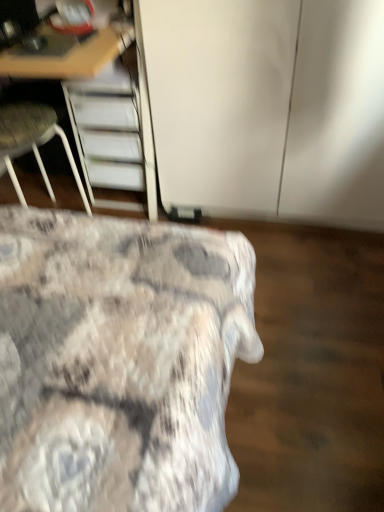
Where is `wooden desk at upper left`? wooden desk at upper left is located at coordinates (72, 57).

What do you see at coordinates (269, 106) in the screenshot?
I see `white glossy cabinet at upper center` at bounding box center [269, 106].

Locate an element on the screen. textured fabric bed at lower left is located at coordinates (119, 361).

Who is shorter, white fabric chair at left or textured fabric bed at lower left?

With less height is textured fabric bed at lower left.

Would you consider white fabric chair at left to be distant from textured fabric bed at lower left?

No.

From the picture: From the image's perspective, which one is positioned lower, white fabric chair at left or textured fabric bed at lower left?

textured fabric bed at lower left, from the image's perspective.

Is the position of white fabric chair at left less distant than that of white glossy cabinet at upper center?

No, it is not.

Between white fabric chair at left and white glossy cabinet at upper center, which one has smaller size?

Smaller between the two is white fabric chair at left.

How distant is white fabric chair at left from white glossy cabinet at upper center?

A distance of 27.78 inches exists between white fabric chair at left and white glossy cabinet at upper center.

I want to click on chair below the white glossy cabinet at upper center (from a real-world perspective), so click(32, 142).

Between white glossy cabinet at upper center and textured fabric bed at lower left, which one has less height?

Standing shorter between the two is textured fabric bed at lower left.

Could you tell me if white glossy cabinet at upper center is facing textured fabric bed at lower left?

Yes, white glossy cabinet at upper center is turned towards textured fabric bed at lower left.

Would you say textured fabric bed at lower left is part of white glossy cabinet at upper center's contents?

No, textured fabric bed at lower left is located outside of white glossy cabinet at upper center.

From a real-world perspective, is white glossy cabinet at upper center above or below textured fabric bed at lower left?

Clearly, from a real-world perspective, white glossy cabinet at upper center is above textured fabric bed at lower left.

Can you confirm if textured fabric bed at lower left is thinner than wooden desk at upper left?

No.

Between textured fabric bed at lower left and wooden desk at upper left, which one has more height?

wooden desk at upper left is taller.

Is textured fabric bed at lower left further to camera compared to wooden desk at upper left?

No, textured fabric bed at lower left is in front of wooden desk at upper left.

From the picture: Visually, is white fabric chair at left positioned to the left or to the right of wooden desk at upper left?

From the image, it's evident that white fabric chair at left is to the left of wooden desk at upper left.

From the image's perspective, is white fabric chair at left positioned above or below wooden desk at upper left?

white fabric chair at left is below wooden desk at upper left.

Can wooden desk at upper left be found inside white fabric chair at left?

No, wooden desk at upper left is not surrounded by white fabric chair at left.

From a real-world perspective, is white fabric chair at left physically located above or below wooden desk at upper left?

white fabric chair at left is situated lower than wooden desk at upper left in the real world.

From a real-world perspective, relative to white fabric chair at left, is white glossy cabinet at upper center vertically above or below?

white glossy cabinet at upper center is above white fabric chair at left.

Is there a large distance between white glossy cabinet at upper center and white fabric chair at left?

white glossy cabinet at upper center is actually quite close to white fabric chair at left.

Can you confirm if white glossy cabinet at upper center is smaller than white fabric chair at left?

No, white glossy cabinet at upper center is not smaller than white fabric chair at left.

The width and height of the screenshot is (384, 512). Find the location of `cabinetry to the right of white fabric chair at left`. cabinetry to the right of white fabric chair at left is located at coordinates [x=269, y=106].

Which point is more distant from viewer, (91, 45) or (128, 492)?

The point (91, 45) is farther.

From a real-world perspective, which object stands above the other?

wooden desk at upper left, from a real-world perspective.

Can textured fabric bed at lower left be found inside wooden desk at upper left?

Definitely not — textured fabric bed at lower left is not inside wooden desk at upper left.

Find the location of `bed that appears in front of the wooden desk at upper left`. bed that appears in front of the wooden desk at upper left is located at coordinates (119, 361).

Find the location of a particular element. chair behind the textured fabric bed at lower left is located at coordinates (32, 142).

Locate an element on the screen. chair below the white glossy cabinet at upper center (from the image's perspective) is located at coordinates click(x=32, y=142).

Which object lies nearer to the anchor point white fabric chair at left, textured fabric bed at lower left or white glossy cabinet at upper center?

white glossy cabinet at upper center is positioned closer to the anchor white fabric chair at left.

Which object lies nearer to the anchor point wooden desk at upper left, textured fabric bed at lower left or white fabric chair at left?

white fabric chair at left lies closer to wooden desk at upper left than the other object.

Which object lies further to the anchor point white glossy cabinet at upper center, wooden desk at upper left or textured fabric bed at lower left?

textured fabric bed at lower left lies further to white glossy cabinet at upper center than the other object.

From the picture: Based on their spatial positions, is wooden desk at upper left or white glossy cabinet at upper center closer to textured fabric bed at lower left?

wooden desk at upper left lies closer to textured fabric bed at lower left than the other object.

Which object lies nearer to the anchor point white fabric chair at left, textured fabric bed at lower left or wooden desk at upper left?

Answer: Among the two, wooden desk at upper left is located nearer to white fabric chair at left.

Considering their positions, is textured fabric bed at lower left positioned closer to white glossy cabinet at upper center than wooden desk at upper left?

wooden desk at upper left.

When comparing their distances from textured fabric bed at lower left, does white fabric chair at left or wooden desk at upper left seem closer?

The object closer to textured fabric bed at lower left is wooden desk at upper left.

Estimate the real-world distances between objects in this image. Which object is further from textured fabric bed at lower left, white glossy cabinet at upper center or white fabric chair at left?

white fabric chair at left is further to textured fabric bed at lower left.

You are a GUI agent. You are given a task and a screenshot of the screen. Output one action in this format:
    pyautogui.click(x=<x>, y=<y>)
    Task: Click on the bed between wooden desk at upper left and white glossy cabinet at upper center
    The width and height of the screenshot is (384, 512).
    Given the screenshot: What is the action you would take?
    pyautogui.click(x=119, y=361)

Identify the location of chair between wooden desk at upper left and textured fabric bed at lower left in the vertical direction. pos(32,142).

This screenshot has height=512, width=384. Find the location of `furniture situated between white fabric chair at left and white glossy cabinet at upper center from left to right`. furniture situated between white fabric chair at left and white glossy cabinet at upper center from left to right is located at coordinates (72, 57).

Identify the location of bed situated between white fabric chair at left and white glossy cabinet at upper center from left to right. The width and height of the screenshot is (384, 512). (119, 361).